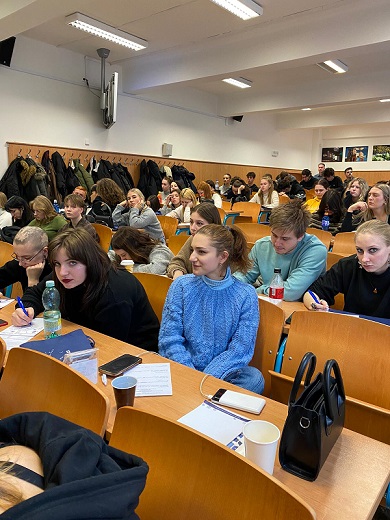
At what (x,y) coordinates should I click in order to perform the action: click on tables. Please return your answer as a coordinate pair (x, y). Looking at the image, I should click on (348, 487), (286, 304).